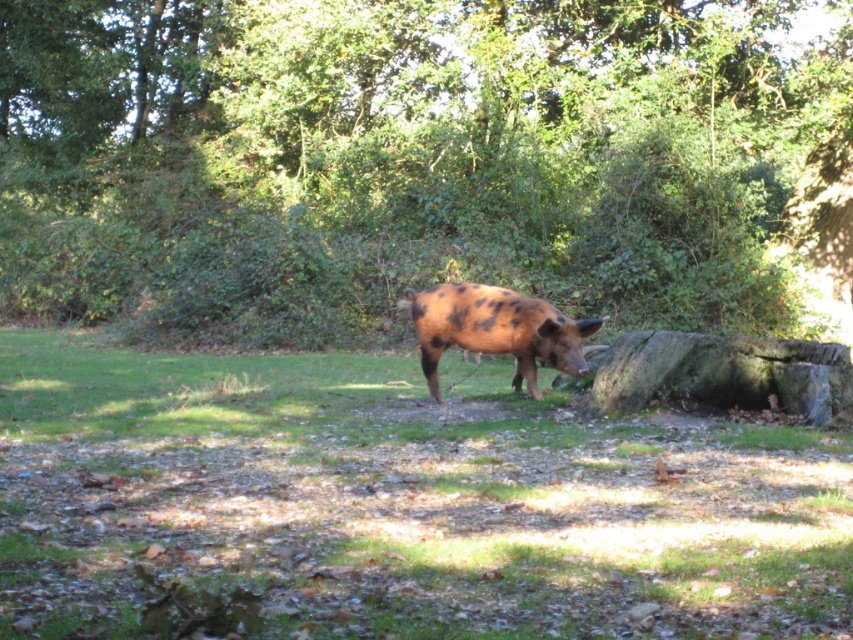
Between brown grassy at center and spotted brown pig at center, which one appears on the left side from the viewer's perspective?

brown grassy at center is more to the left.

Identify the location of brown grassy at center. (401, 502).

What do you see at coordinates (401, 502) in the screenshot? Image resolution: width=853 pixels, height=640 pixels. I see `brown grassy at center` at bounding box center [401, 502].

Where is `brown grassy at center`? brown grassy at center is located at coordinates point(401,502).

Does point (10, 220) come behind point (265, 364)?

Yes, point (10, 220) is behind point (265, 364).

Is green leafy tree at center behind brown grassy at center?

Yes, green leafy tree at center is further from the viewer.

The width and height of the screenshot is (853, 640). Describe the element at coordinates (422, 163) in the screenshot. I see `green leafy tree at center` at that location.

At what (x,y) coordinates should I click in order to perform the action: click on green leafy tree at center. Please return your answer as a coordinate pair (x, y). Looking at the image, I should click on (422, 163).

Is green leafy tree at center smaller than spotted brown pig at center?

No, green leafy tree at center is not smaller than spotted brown pig at center.

Is point (535, 208) closer to viewer compared to point (498, 323)?

No, it is not.

Image resolution: width=853 pixels, height=640 pixels. What are the coordinates of `green leafy tree at center` in the screenshot? It's located at (422, 163).